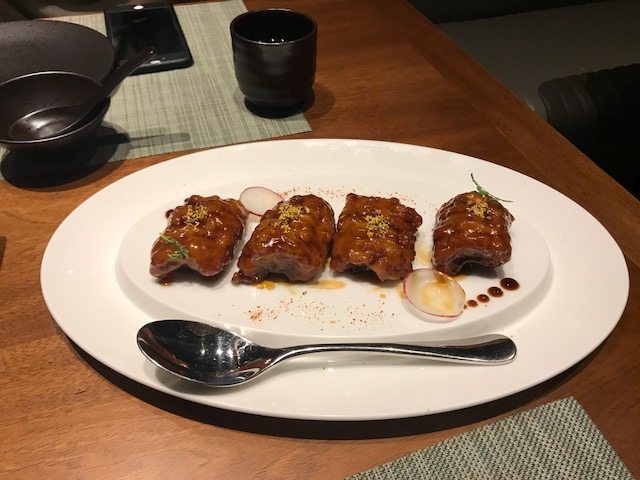
Identify the location of black plate. The height and width of the screenshot is (480, 640). (41, 58).